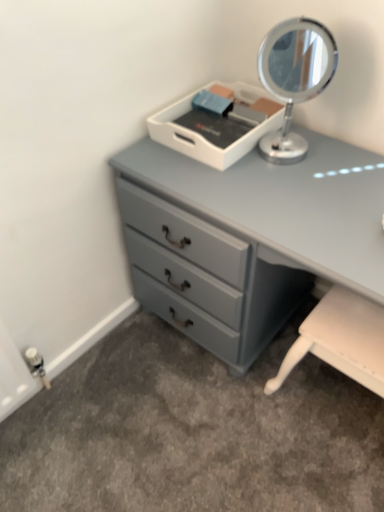
Locate an element on the screen. The image size is (384, 512). unoccupied area in front of silver metallic mirror at upper right is located at coordinates (293, 189).